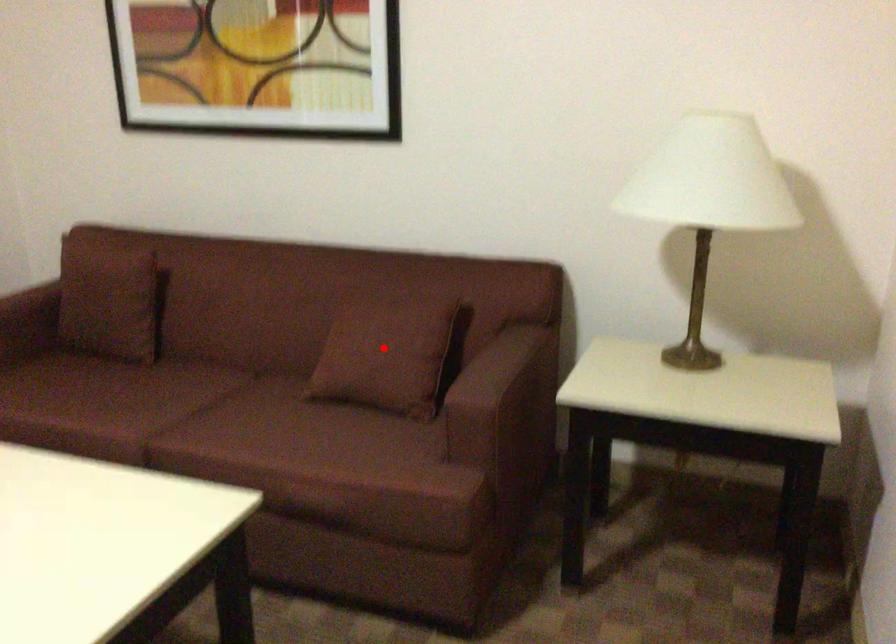
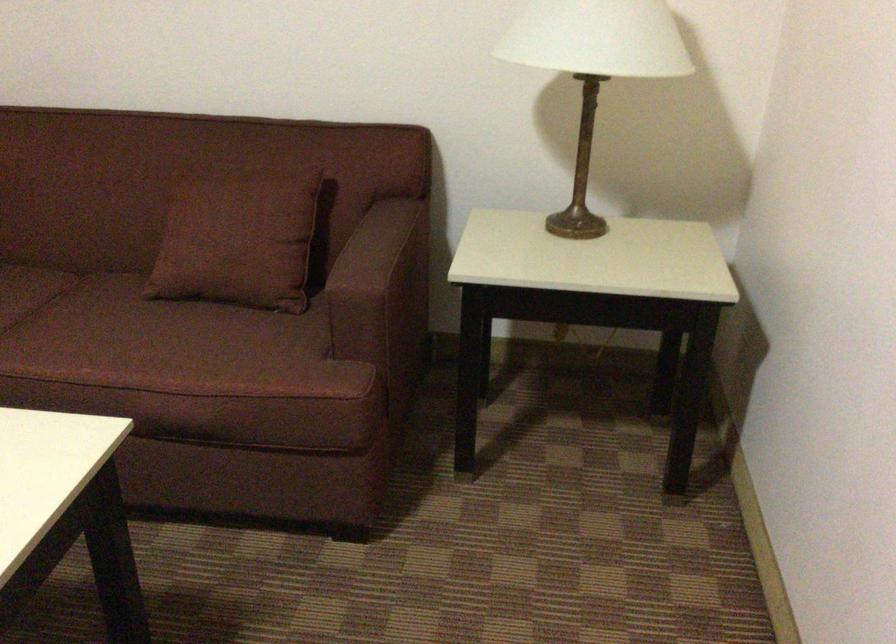
Where in the second image is the point corresponding to the highlighted location from the first image?

(238, 234)